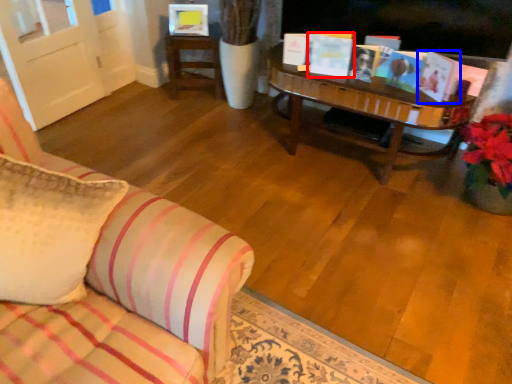
Question: Which point is closer to the camera, book (highlighted by a red box) or book (highlighted by a blue box)?

Choices:
 (A) book
 (B) book

Answer: (B)